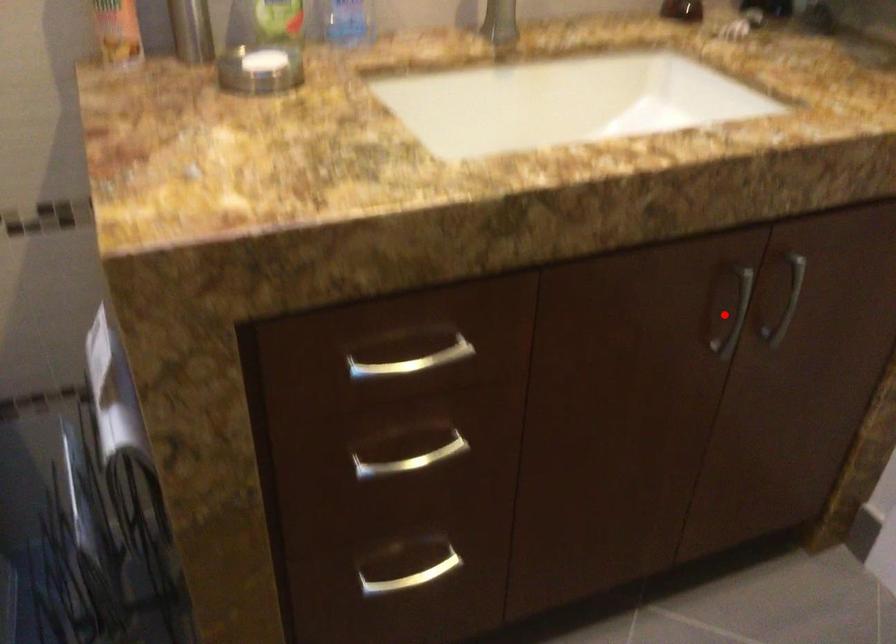
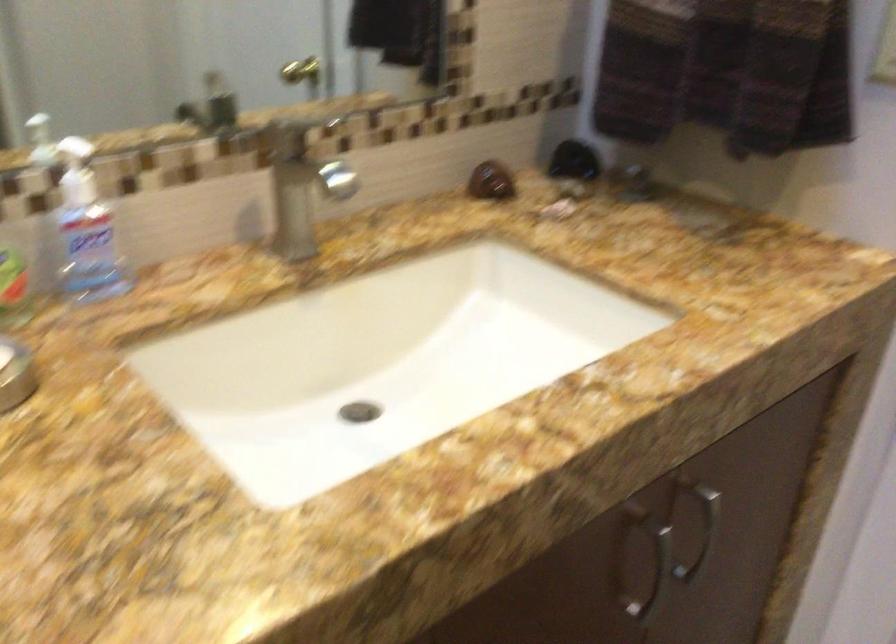
Question: I am providing you with two images of the same scene from different viewpoints. A red point is marked on the first image. At the location where the point appears in image 1, is it still visible in image 2?

Choices:
 (A) Yes
 (B) No

Answer: (A)